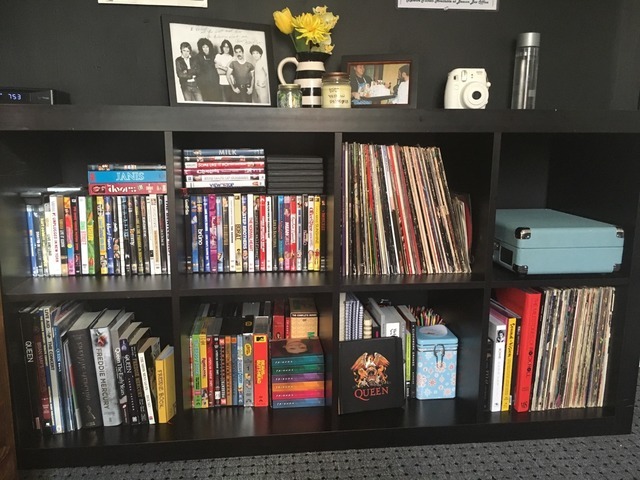
This screenshot has width=640, height=480. What are the coordinates of `handle of vase` in the screenshot? It's located at (290, 58).